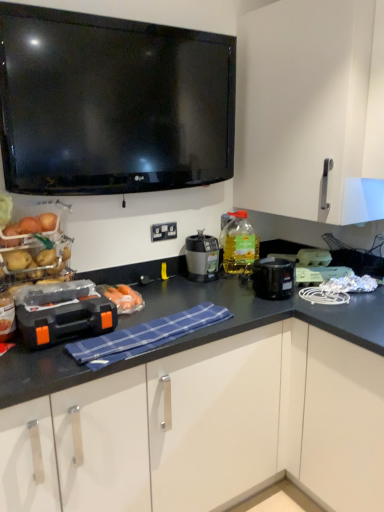
Identify the location of vacant region above orange plastic toolbox at center, marked as the third appliance in a right-to-left arrangement (from a real-world perspective). The height and width of the screenshot is (512, 384). (62, 304).